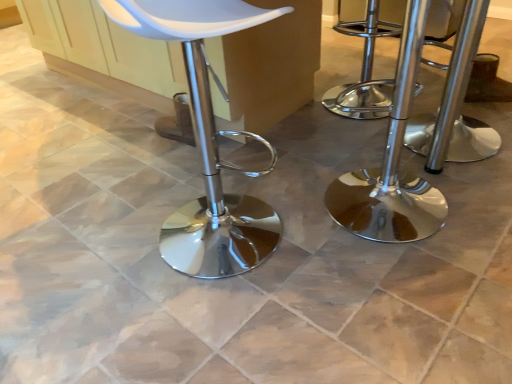
The height and width of the screenshot is (384, 512). What are the coordinates of `free area in between white matte stool at center and chrome/metallic stool at right, the second stool positioned from the right` in the screenshot? It's located at (296, 219).